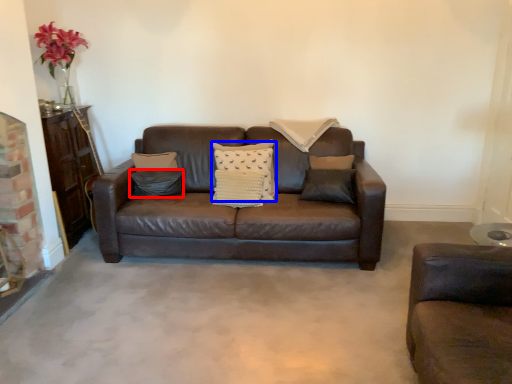
Question: Which point is closer to the camera, pillow (highlighted by a red box) or pillow (highlighted by a blue box)?

Choices:
 (A) pillow
 (B) pillow

Answer: (B)